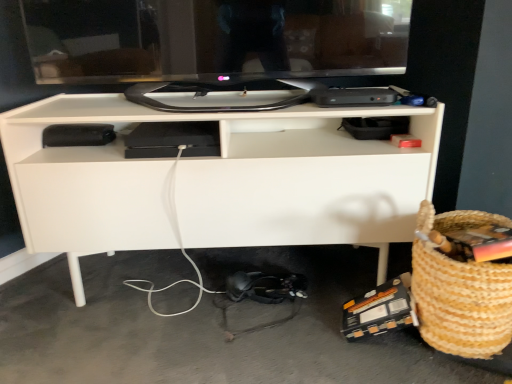
The height and width of the screenshot is (384, 512). I want to click on free region on the left part of braided straw basket at lower right, so click(338, 342).